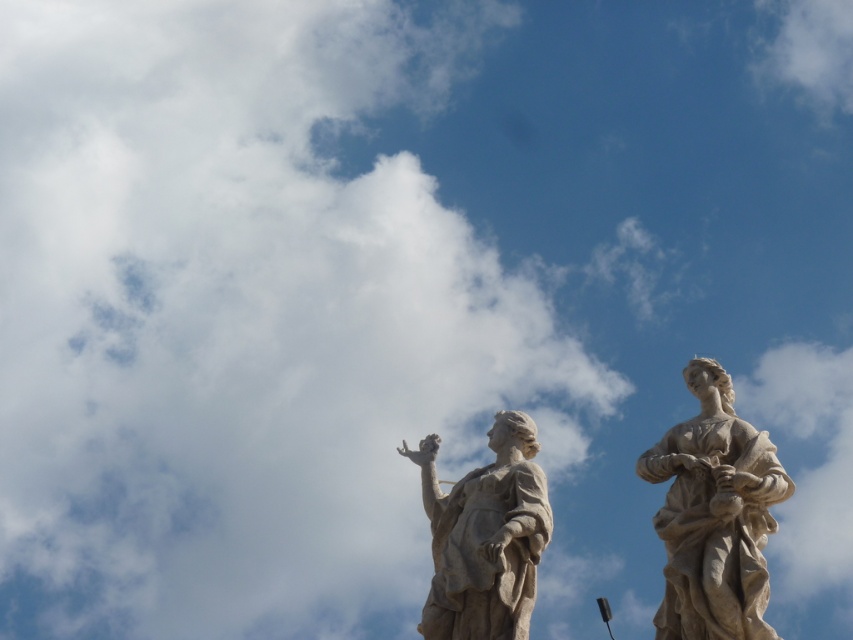
Who is more forward, (694, 580) or (466, 547)?

Point (694, 580) is in front.

Does white marble statue at right appear on the right side of white marble statue at center?

Correct, you'll find white marble statue at right to the right of white marble statue at center.

Which is in front, point (674, 458) or point (503, 561)?

Point (674, 458) is in front.

Image resolution: width=853 pixels, height=640 pixels. Identify the location of white marble statue at right. (714, 515).